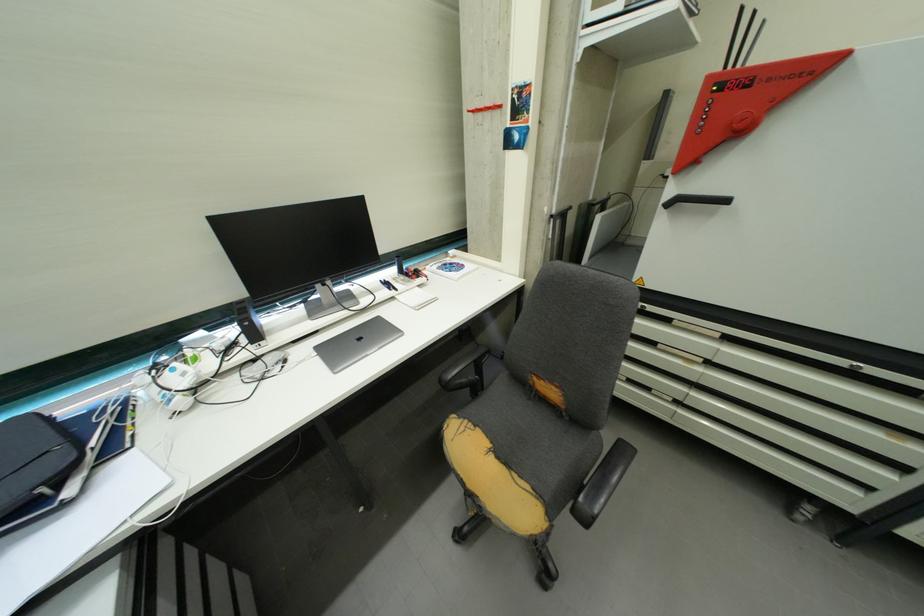
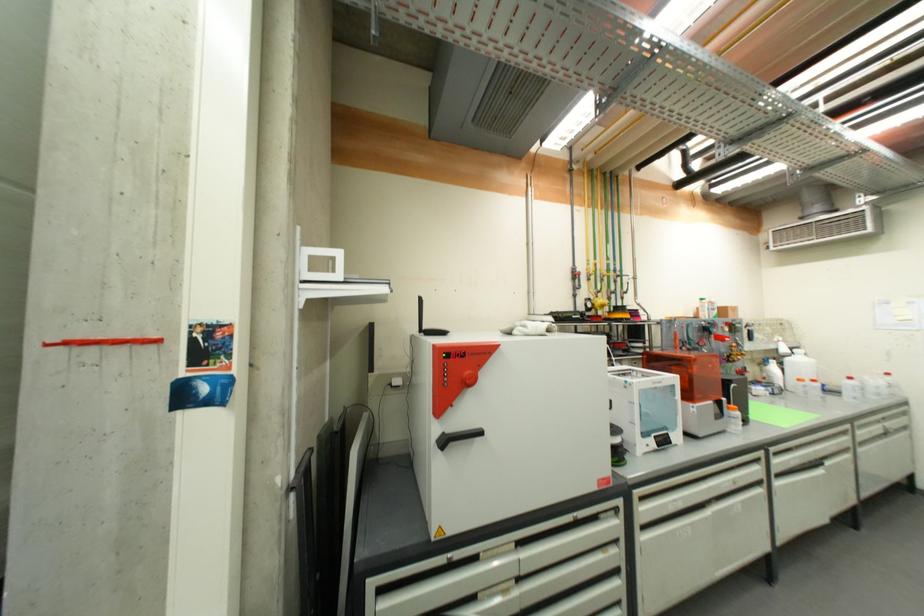
In the scene shown: Based on the continuous images, in which direction is the camera rotating?

The camera's rotation is toward right-up.